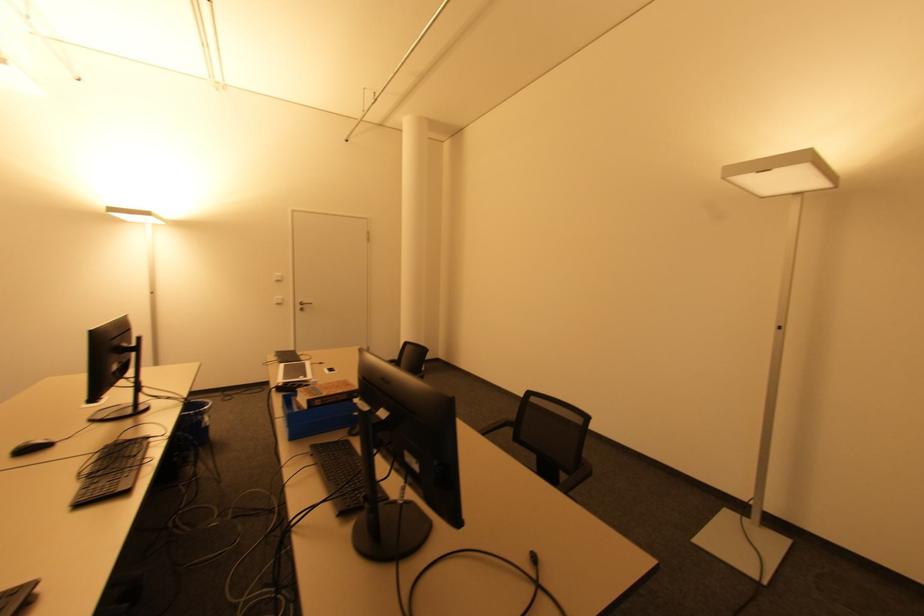
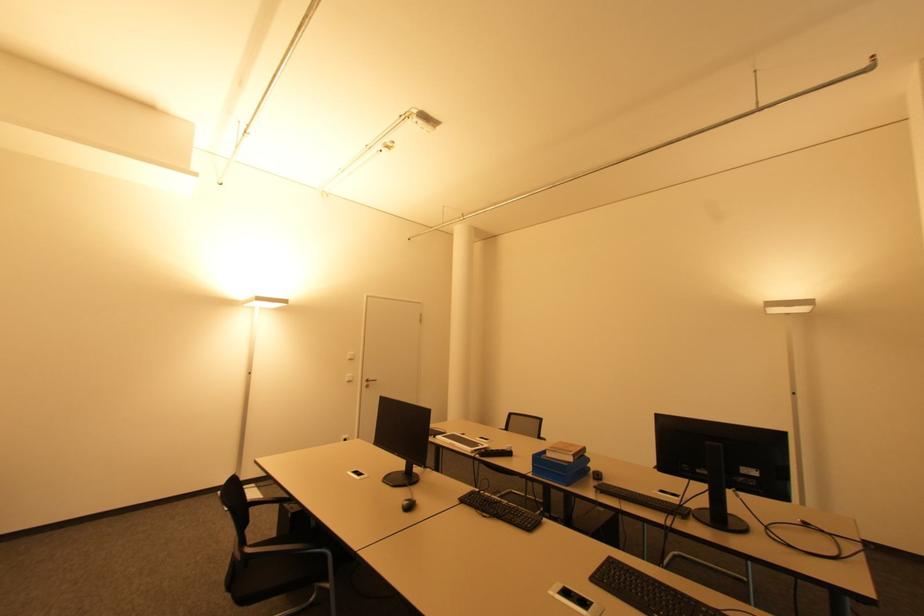
Question: The images are taken continuously from a first-person perspective. In which direction are you moving?

Choices:
 (A) Left
 (B) Right
 (C) Forward
 (D) Backward

Answer: (A)